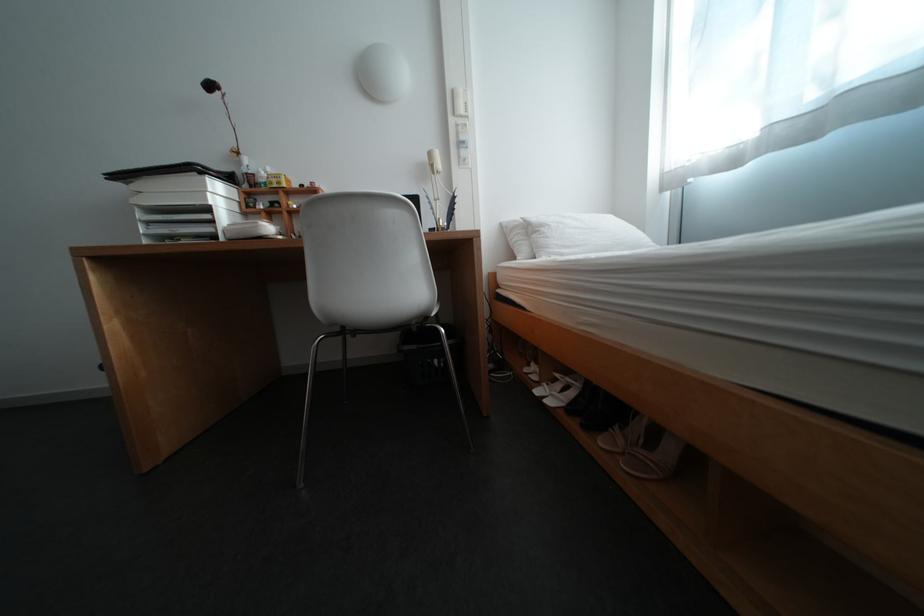
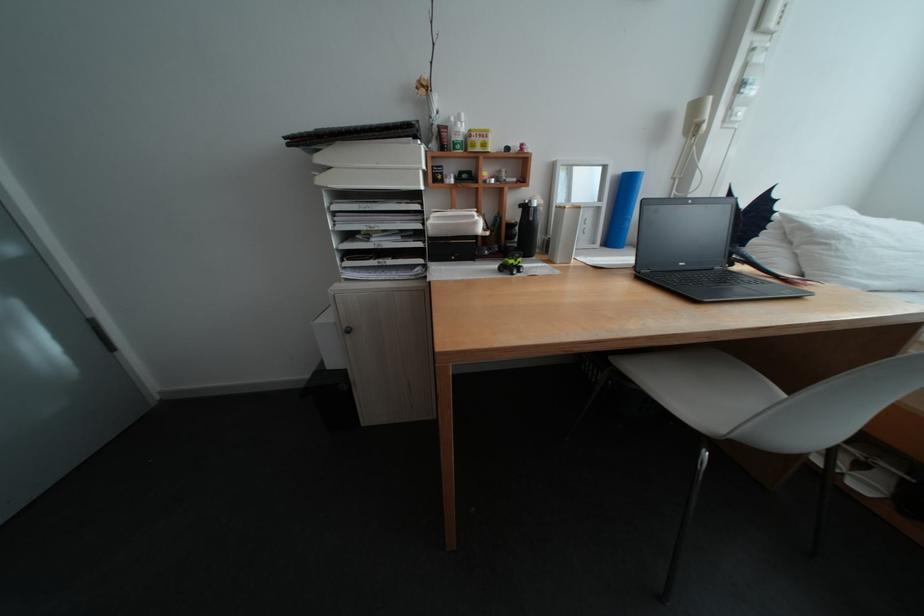
Locate, in the second image, the point that corresponds to point (260, 175) in the first image.

(453, 128)